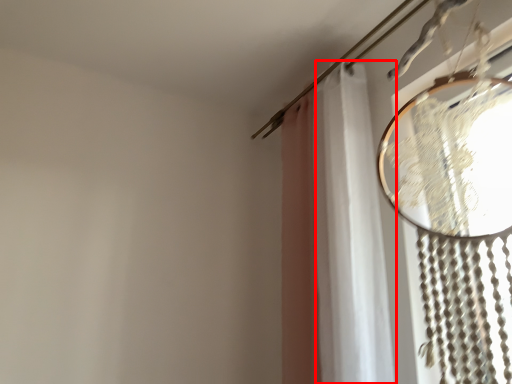
Question: Observing the image, what is the correct spatial positioning of shower curtain (annotated by the red box) in reference to curtain?

Choices:
 (A) right
 (B) left

Answer: (B)